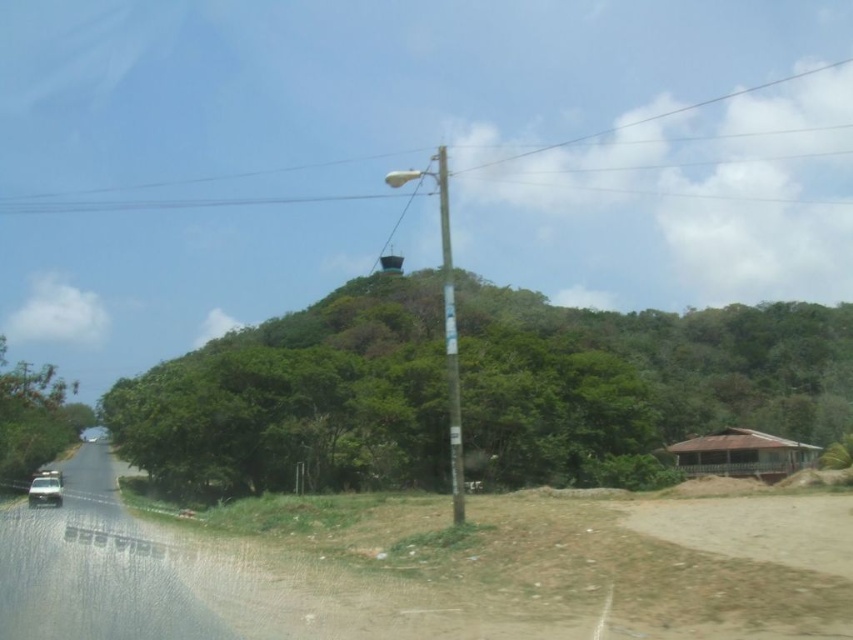
You are a pedestrian standing on the side of the road and want to see the approaching vehicle in the distance. Which object can you use to check the distance of the metallic silver car at lower left and transparent glass car window at lower left?

The metallic silver car at lower left has a greater height compared to the transparent glass car window at lower left, so you can use the metallic silver car at lower left to estimate the distance since it is taller and more visible from afar.

You are a pedestrian standing at the start of the road. You want to walk to the utility pole near the center right. Which tree should you pass first, the green leafy tree at center or the green leafy tree at left?

You should pass the green leafy tree at left first because the green leafy tree at center is to the right of it, so the green leafy tree at left is closer to your starting position.